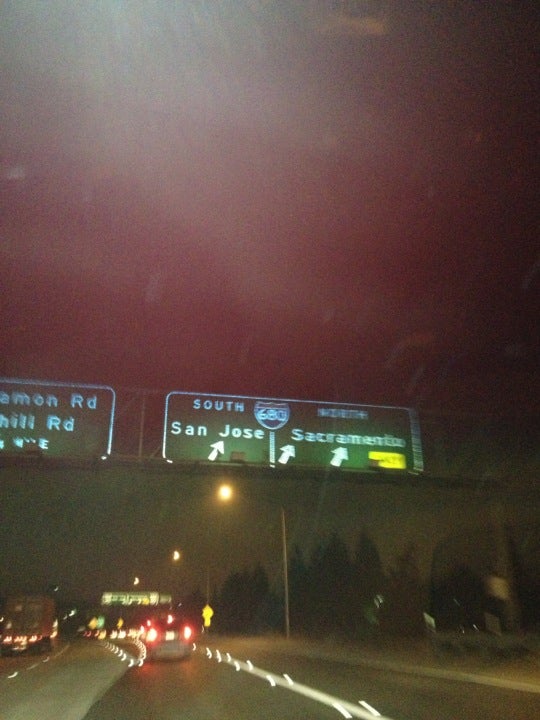
You are a GUI agent. You are given a task and a screenshot of the screen. Output one action in this format:
    pyautogui.click(x=<x>, y=<y>)
    Task: Click on the light
    
    Given the screenshot: What is the action you would take?
    pyautogui.click(x=218, y=484)